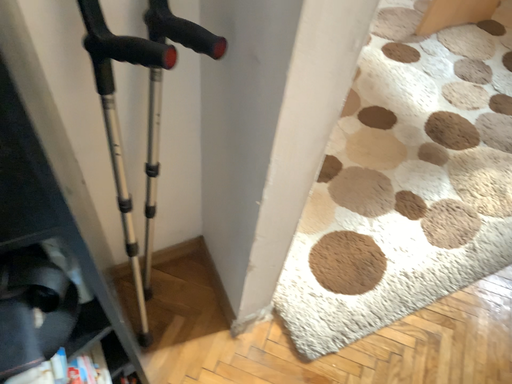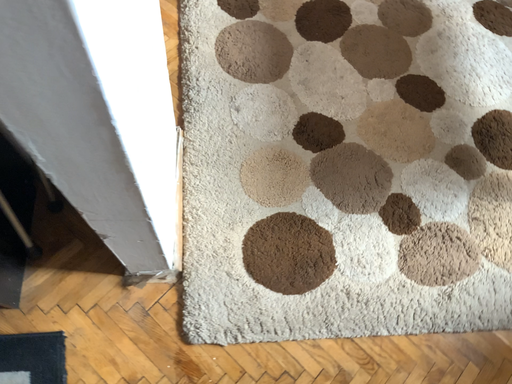
Question: How did the camera likely rotate when shooting the video?

Choices:
 (A) rotated right
 (B) rotated left

Answer: (B)